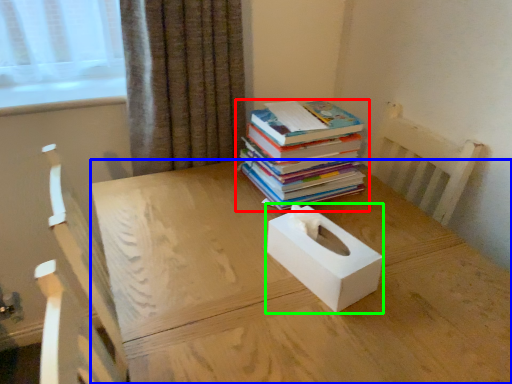
Question: Which is nearer to the book (highlighted by a red box)? desk (highlighted by a blue box) or box (highlighted by a green box).

Choices:
 (A) desk
 (B) box

Answer: (A)